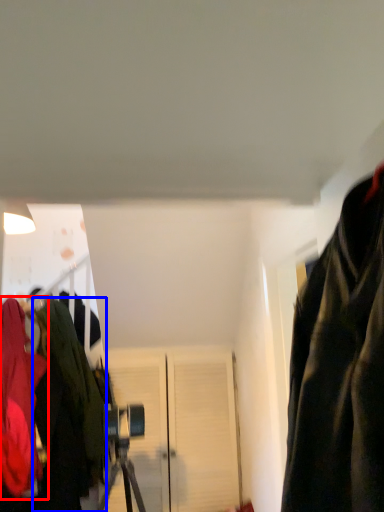
Question: Among these objects, which one is nearest to the camera, jacket (highlighted by a red box) or jacket (highlighted by a blue box)?

Choices:
 (A) jacket
 (B) jacket

Answer: (A)